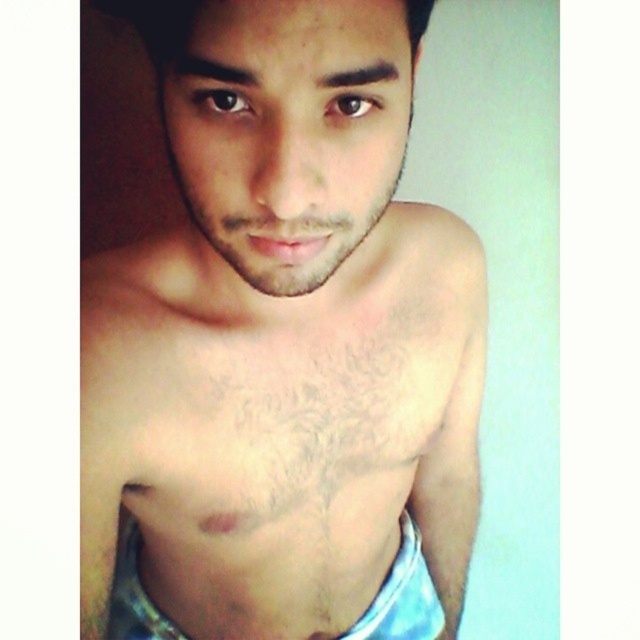
You are a photographer setting up a lighting setup for a portrait. You notice the pale skin at center and the blue fabric shorts at center in the scene. Which object is positioned closer to the camera?

The pale skin at center is closer to the viewer than the blue fabric shorts at center, so the pale skin at center is positioned closer to the camera.